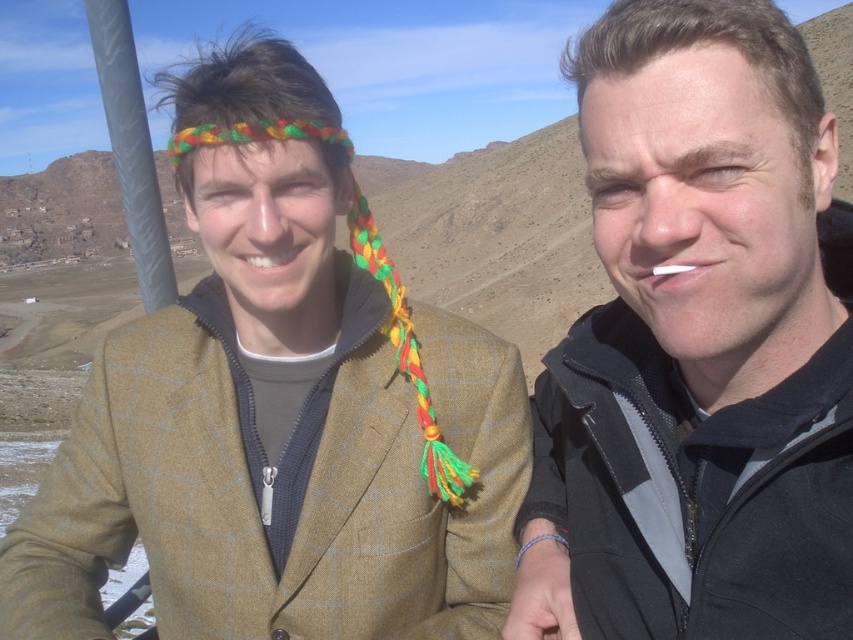
You are standing in front of the two people in the image. Which of the two points, point (770, 285) or point (306, 138), appears closer to you?

Point (770, 285) is closer to the viewer than point (306, 138).

You are planning to take a photo of both the matte black jacket at right and the multicolored braided headscarf at left in the scene. Given that your camera has a maximum focus range of 8 meters, will you be able to capture both subjects clearly in the same photo?

The matte black jacket at right and multicolored braided headscarf at left are 9.10 meters apart. Since the camera can only focus up to 8 meters, capturing both in the same photo clearly would not be possible as the distance exceeds the maximum focus range.

Consider the image. You are planning to take a photo of the matte black jacket at right and the metallic gray pole at left. Which object should you focus on first if you want to capture both in the frame without moving the camera?

You should focus on the metallic gray pole at left first because it is larger and closer to the camera than the matte black jacket at right, ensuring both are in focus when using depth of field techniques.